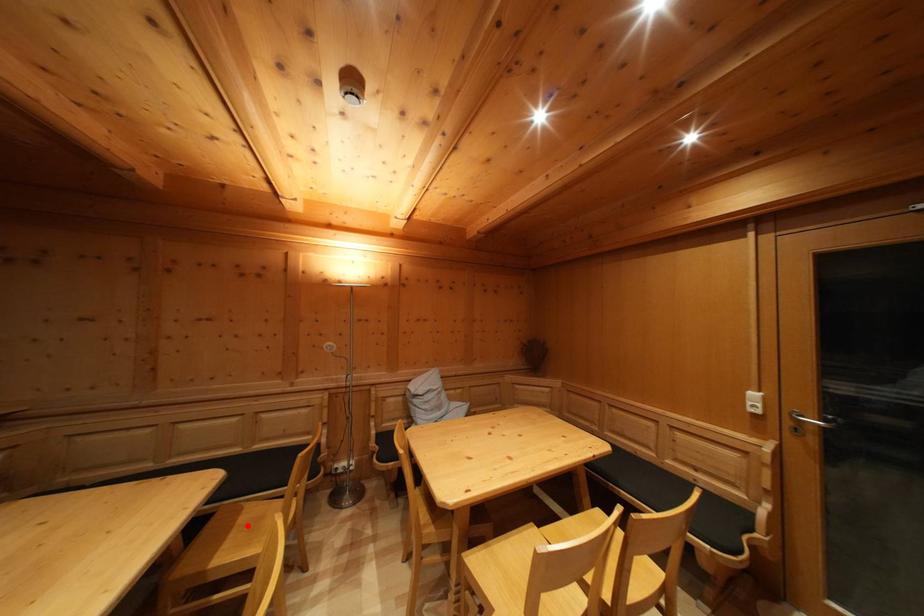
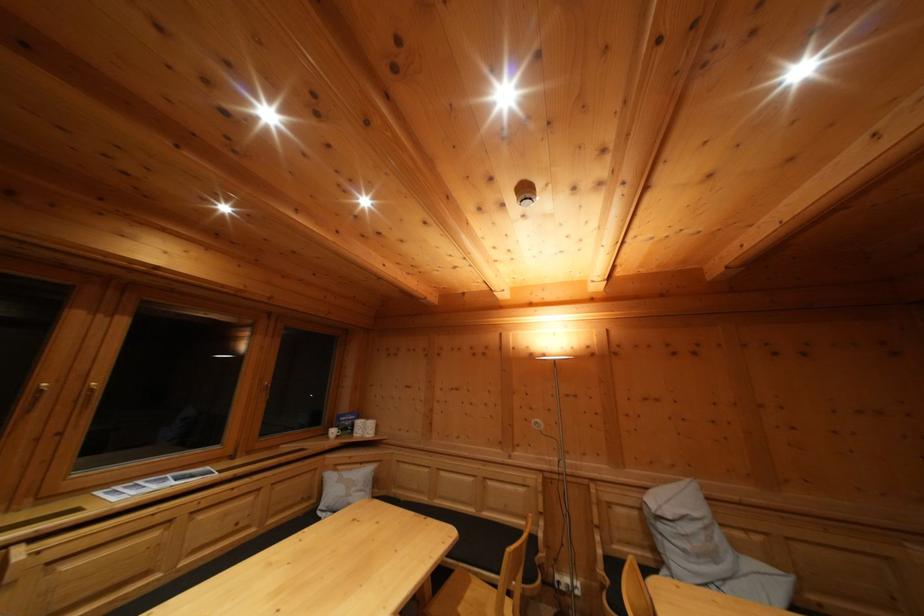
Find the pixel in the second image that matches the highlighted location in the first image.

(475, 601)